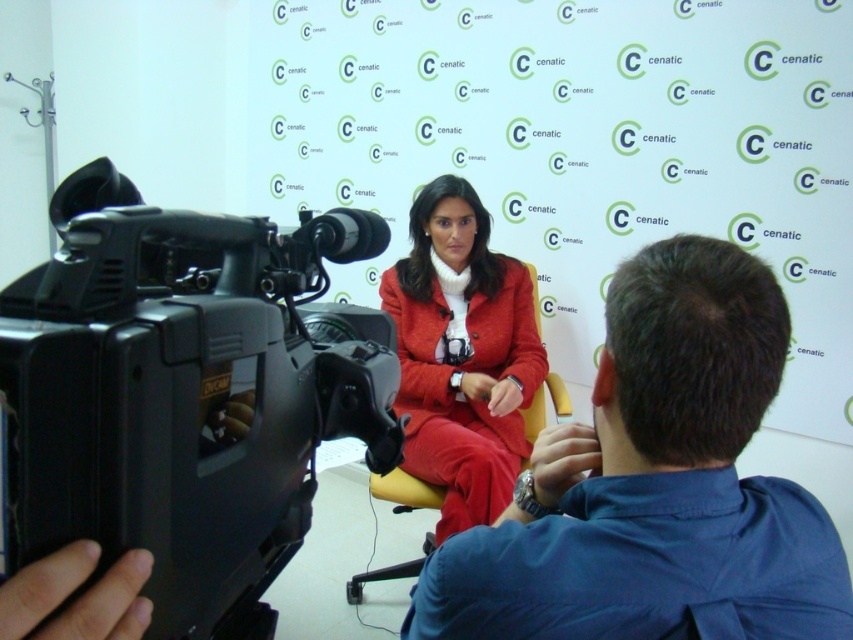
Question: Does black plastic video camera at left appear under blue cotton shirt at center?

Choices:
 (A) no
 (B) yes

Answer: (A)

Question: Among these objects, which one is nearest to the camera?

Choices:
 (A) blue cotton shirt at center
 (B) black plastic video camera at left

Answer: (B)

Question: Which object is farther from the camera taking this photo?

Choices:
 (A) black plastic video camera at left
 (B) matte red suit at center

Answer: (B)

Question: In this image, where is black plastic video camera at left located relative to matte red suit at center?

Choices:
 (A) right
 (B) left

Answer: (B)

Question: Among these points, which one is nearest to the camera?

Choices:
 (A) (465, 509)
 (B) (740, 621)

Answer: (B)

Question: Is blue cotton shirt at center behind matte red suit at center?

Choices:
 (A) yes
 (B) no

Answer: (B)